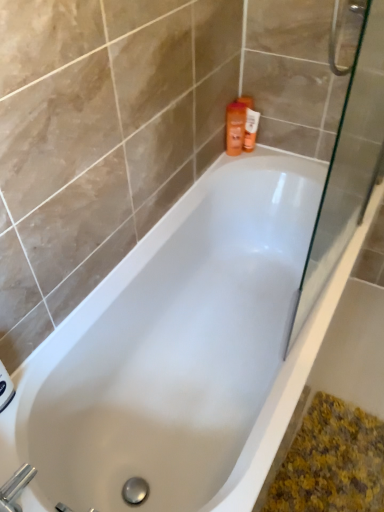
Locate an element on the screen. free location in front of orange matte bottle at upper right is located at coordinates (243, 163).